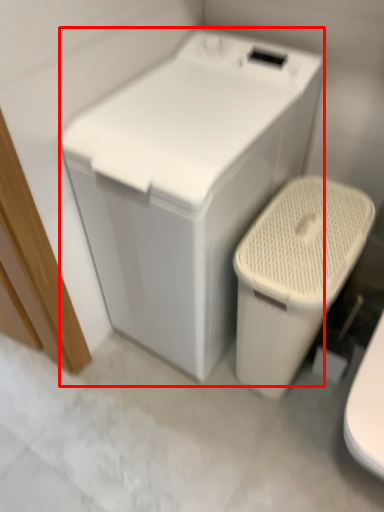
Question: In this image, where is washing machine (annotated by the red box) located relative to toilet?

Choices:
 (A) right
 (B) left

Answer: (B)